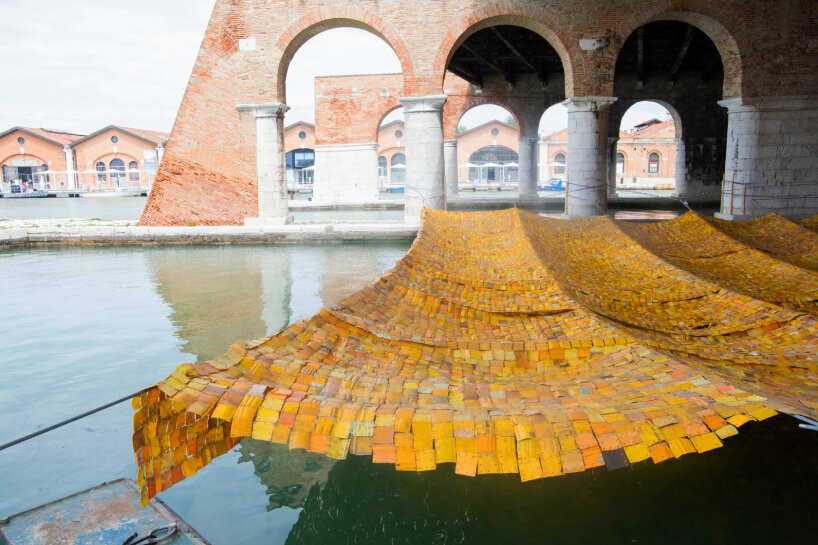
Identify the location of doors. (25, 174), (491, 175), (303, 174).